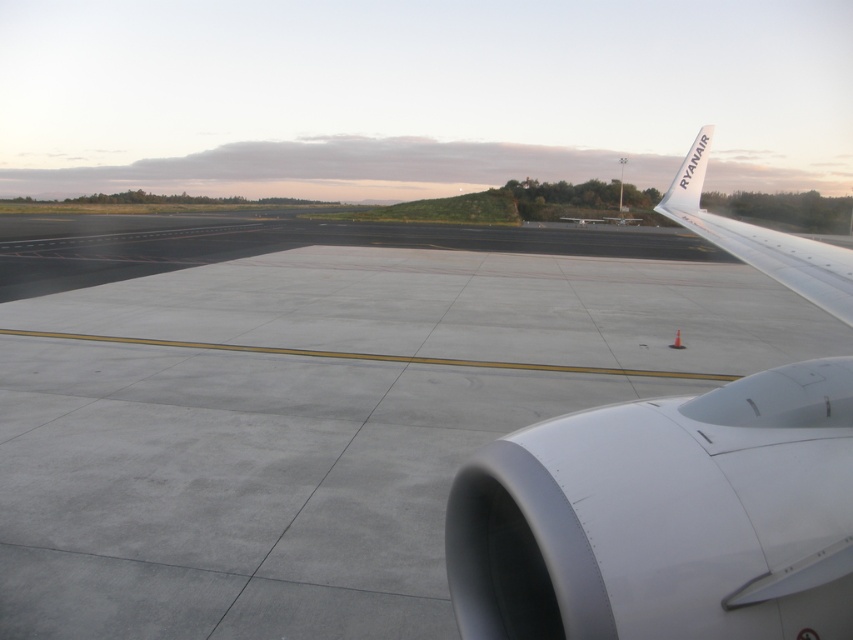
The width and height of the screenshot is (853, 640). What do you see at coordinates (664, 516) in the screenshot?
I see `white matte airplane wing at upper right` at bounding box center [664, 516].

Which is behind, point (787, 461) or point (840, 253)?

Positioned behind is point (840, 253).

You are a GUI agent. You are given a task and a screenshot of the screen. Output one action in this format:
    pyautogui.click(x=<x>, y=<y>)
    Task: Click on the white matte airplane wing at upper right
    
    Given the screenshot: What is the action you would take?
    pyautogui.click(x=664, y=516)